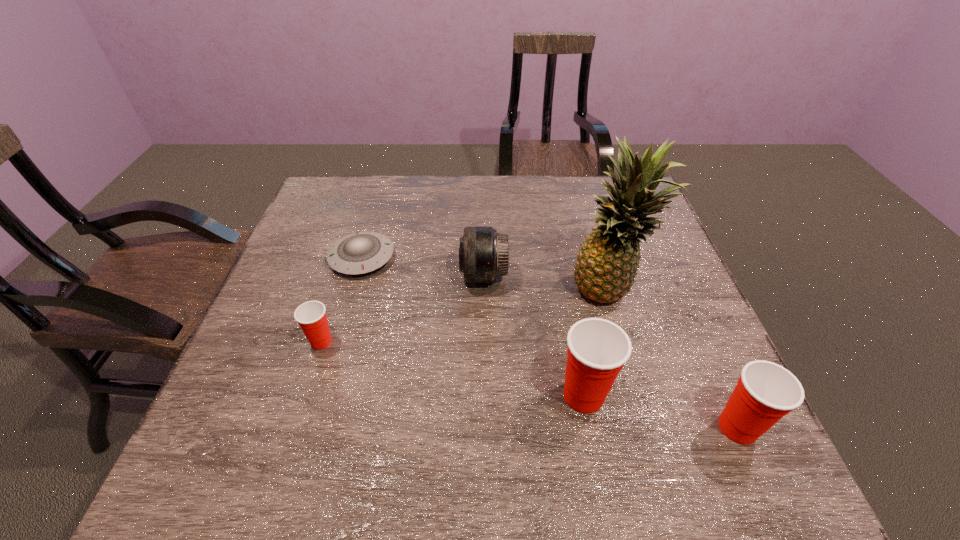
Find the location of a particular element. Image resolution: width=960 pixels, height=540 pixels. vacant area between the second Dixie cup from right to left and the shortest object is located at coordinates (472, 327).

Where is `vacant area between the leftmost Dixie cup and the telephoto lens`? Image resolution: width=960 pixels, height=540 pixels. vacant area between the leftmost Dixie cup and the telephoto lens is located at coordinates (402, 308).

You are a GUI agent. You are given a task and a screenshot of the screen. Output one action in this format:
    pyautogui.click(x=<x>, y=<y>)
    Task: Click on the unoccupied area between the telephoto lens and the second Dixie cup from right to left
    
    Given the screenshot: What is the action you would take?
    pyautogui.click(x=534, y=335)

Point out which object is positioned as the fifth nearest to the shortest object. Please provide its 2D coordinates. Your answer should be formatted as a tuple, i.e. [(x, y)], where the tuple contains the x and y coordinates of a point satisfying the conditions above.

[(765, 392)]

At what (x,y) coordinates should I click in order to perform the action: click on the third closest object relative to the second tallest Dixie cup. Please return your answer as a coordinate pair (x, y). The height and width of the screenshot is (540, 960). Looking at the image, I should click on (483, 253).

Find the location of a particular element. Image resolution: width=960 pixels, height=540 pixels. Dixie cup that stands as the closest to the second tallest Dixie cup is located at coordinates (597, 350).

What are the coordinates of `Dixie cup that is the second closest to the third object from left to right` in the screenshot? It's located at (311, 316).

At what (x,y) coordinates should I click in order to perform the action: click on free space that satisfies the following two spatial constraints: 1. on the front-facing side of the telephoto lens; 2. on the back side of the second Dixie cup from left to right. Please return your answer as a coordinate pair (x, y). Image resolution: width=960 pixels, height=540 pixels. Looking at the image, I should click on (485, 396).

The image size is (960, 540). Identify the location of free spot that satisfies the following two spatial constraints: 1. on the front-facing side of the second Dixie cup from left to right; 2. on the left side of the telephoto lens. (485, 396).

Where is `vacant region that satisfies the following two spatial constraints: 1. on the front-facing side of the second Dixie cup from left to right; 2. on the left side of the third object from left to right`? This screenshot has height=540, width=960. vacant region that satisfies the following two spatial constraints: 1. on the front-facing side of the second Dixie cup from left to right; 2. on the left side of the third object from left to right is located at coordinates (485, 396).